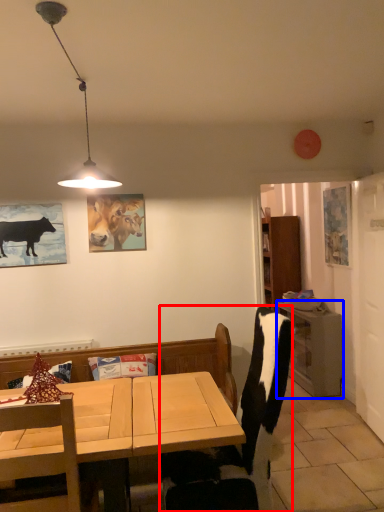
Question: Which object appears farthest to the camera in this image, chair (highlighted by a red box) or table (highlighted by a blue box)?

Choices:
 (A) chair
 (B) table

Answer: (B)